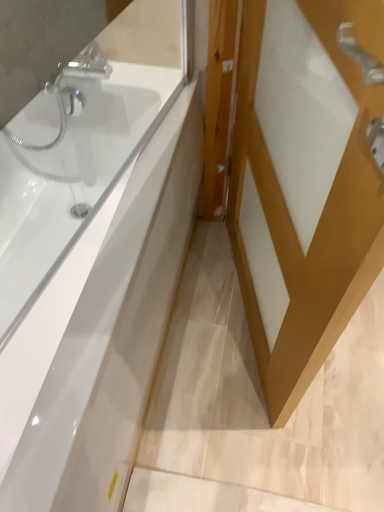
Question: Looking at the image, does white matte door at center seem bigger or smaller compared to white glossy bathtub at upper left?

Choices:
 (A) small
 (B) big

Answer: (A)

Question: Visually, is white matte door at center positioned to the left or to the right of white glossy bathtub at upper left?

Choices:
 (A) right
 (B) left

Answer: (A)

Question: From their relative heights in the image, would you say white matte door at center is taller or shorter than white glossy bathtub at upper left?

Choices:
 (A) short
 (B) tall

Answer: (B)

Question: Visually, is white glossy bathtub at upper left positioned to the left or to the right of white matte door at center?

Choices:
 (A) left
 (B) right

Answer: (A)

Question: From the image's perspective, relative to white matte door at center, is white glossy bathtub at upper left above or below?

Choices:
 (A) above
 (B) below

Answer: (B)

Question: Is white glossy bathtub at upper left taller or shorter than white matte door at center?

Choices:
 (A) tall
 (B) short

Answer: (B)

Question: Considering the positions of point (84, 205) and point (337, 96), is point (84, 205) closer or farther from the camera than point (337, 96)?

Choices:
 (A) farther
 (B) closer

Answer: (A)